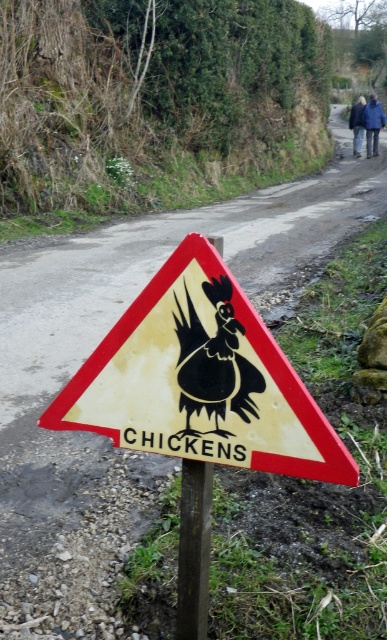
From the picture: You are standing at the point with coordinates point (381, 108) and want to walk to the point with coordinates point (195, 484). According to the scene description, which direction should you face to walk towards your destination?

You should face towards the direction where point (195, 484) is located, which is in front of point (381, 108). Since point (195, 484) is in front of your current position at point (381, 108), you should face forward in the direction of the road that curves gently to the right.

You are a driver approaching the yellow paper sign at center on a narrow, unpaved road that curves to the right. There are dense greenery on the left and a worn sign with a rooster silhouette. Where should you position your vehicle to safely navigate around the sign while staying on the road?

The yellow paper sign at center is located at point (200, 380), so you should position your vehicle towards the right side of the road to safely navigate around the sign while staying on the narrow, unpaved road that curves to the right.

You are a delivery driver approaching the yellow paper sign at center and the brown wooden pole at center on a narrow road. Can you safely pass through the space between them without hitting either object?

The yellow paper sign at center is wider than the brown wooden pole at center. However, since both are positioned at the center of the road, there might not be enough space to pass safely. It is advisable to slow down and carefully assess the clearance before proceeding.